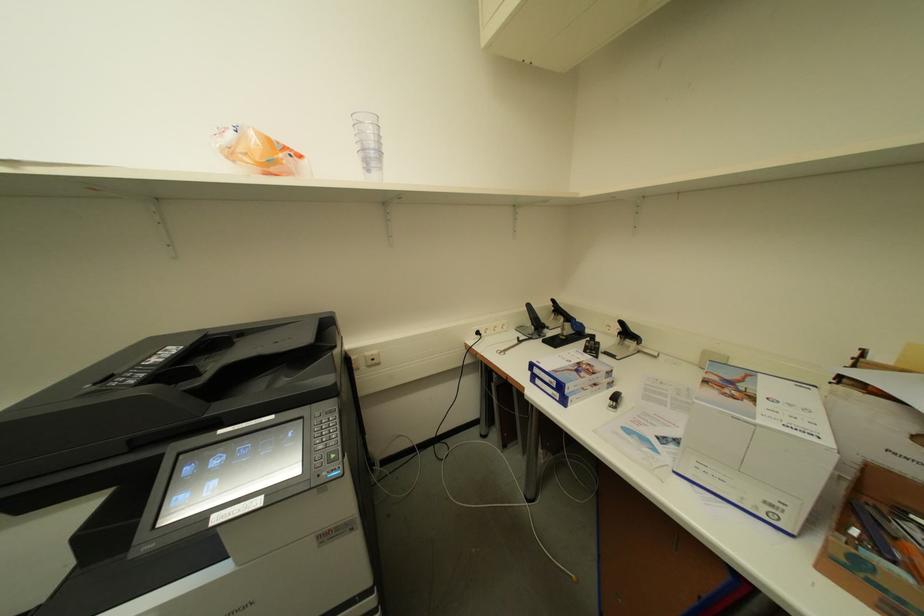
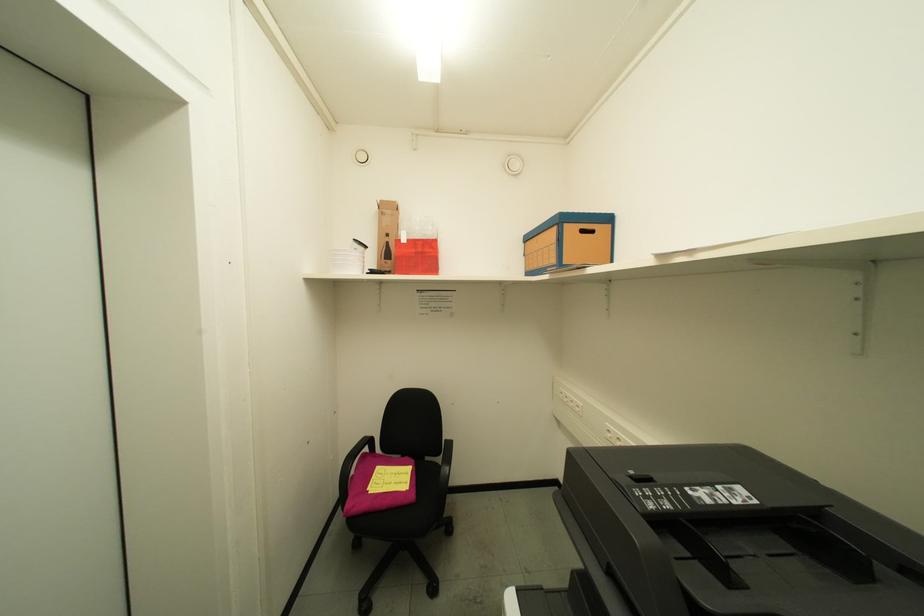
Question: The camera is either moving clockwise (left) or counter-clockwise (right) around the object. The first image is from the beginning of the video and the second image is from the end. Is the camera moving left or right when shooting the video?

Choices:
 (A) Left
 (B) Right

Answer: (B)